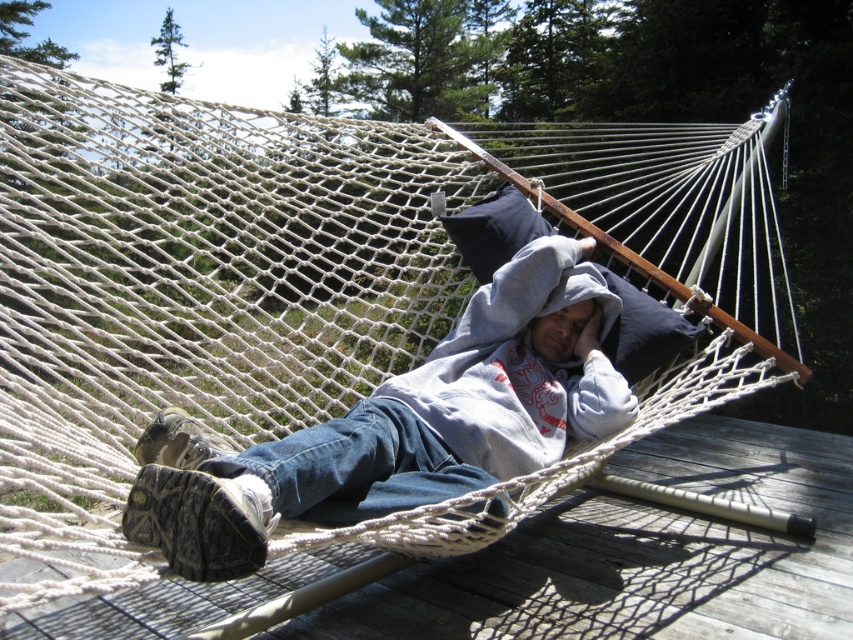
Question: Which point is farther to the camera?

Choices:
 (A) (262, 484)
 (B) (131, 625)

Answer: (B)

Question: Does wooden deck at center have a greater width compared to gray fleece hoodie at center?

Choices:
 (A) no
 (B) yes

Answer: (B)

Question: Is wooden deck at center in front of gray fleece hoodie at center?

Choices:
 (A) no
 (B) yes

Answer: (A)

Question: Can you confirm if wooden deck at center is thinner than gray fleece hoodie at center?

Choices:
 (A) yes
 (B) no

Answer: (B)